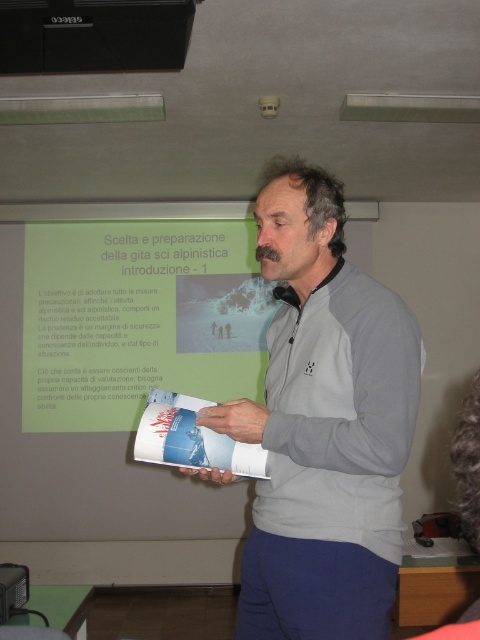
From the picture: Is gray fleece jacket at center closer to camera compared to black plastic projector at upper center?

That is True.

From the picture: Between gray fleece jacket at center and black plastic projector at upper center, which one has less height?

black plastic projector at upper center is shorter.

This screenshot has height=640, width=480. What do you see at coordinates (324, 426) in the screenshot?
I see `gray fleece jacket at center` at bounding box center [324, 426].

I want to click on gray fleece jacket at center, so click(324, 426).